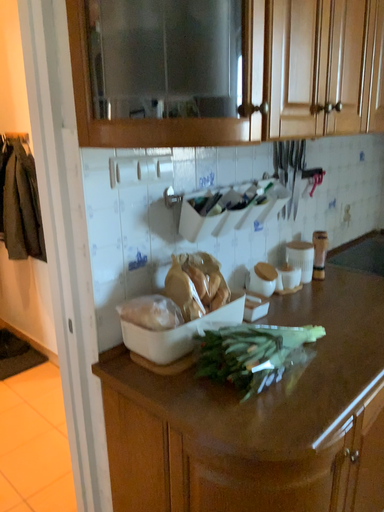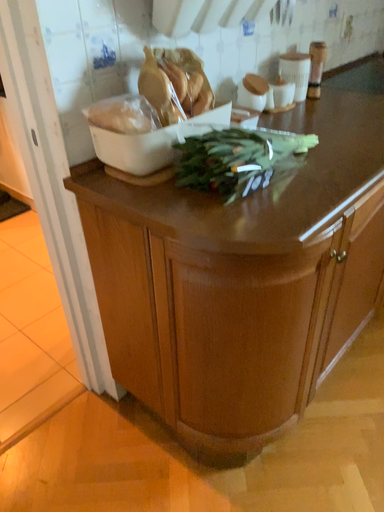
Question: How did the camera likely rotate when shooting the video?

Choices:
 (A) rotated downward
 (B) rotated upward

Answer: (A)